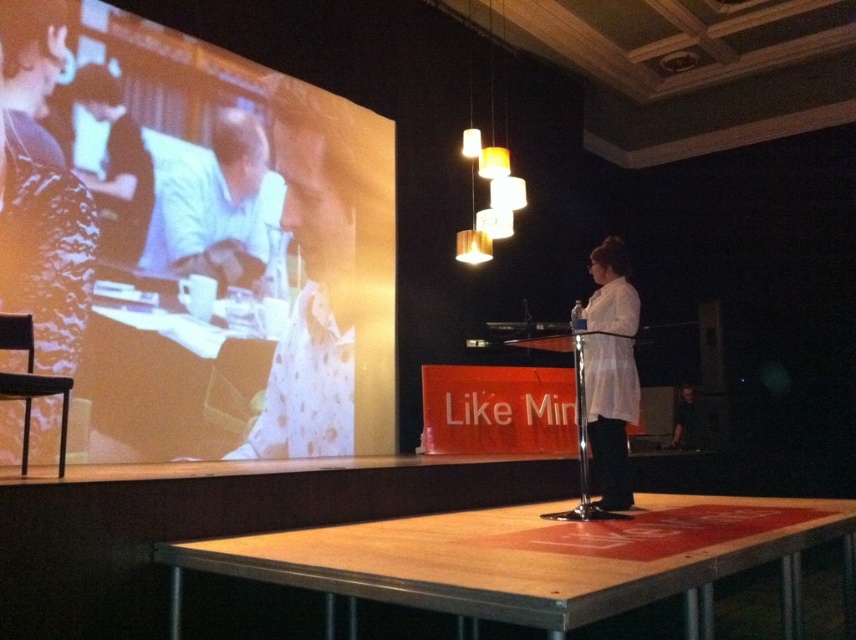
You are an attendee in the presentation and you want to see both the white glossy laptop at upper center and the white matte shirt at center clearly. Which object is closer to the pendant lights above the stage?

The white glossy laptop at upper center is closer to the pendant lights above the stage because it has a lesser height compared to the white matte shirt at center.

You are an attendee sitting in the back row of the conference room. You notice both the white glossy laptop at upper center and the white matte shirt at center. Which object is closer to you?

The white glossy laptop at upper center is closer to you because the white matte shirt at center is behind it.

You are a photographer in the audience of this presentation. You want to take a photo of the white glossy laptop at upper center and the white matte shirt at center so that both are clearly visible in the frame. Given that your camera has a maximum focus range of 2.5 meters, will you be able to capture both objects in focus?

The white glossy laptop at upper center is 2.79 meters away from the white matte shirt at center. Since the distance between them exceeds the camera maximum focus range of 2.5 meters, the photographer cannot capture both objects in focus simultaneously.